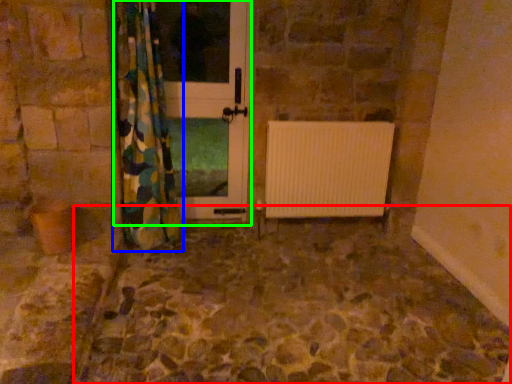
Question: Which is nearer to the path (highlighted by a red box)? curtain (highlighted by a blue box) or screen door (highlighted by a green box).

Choices:
 (A) curtain
 (B) screen door

Answer: (A)